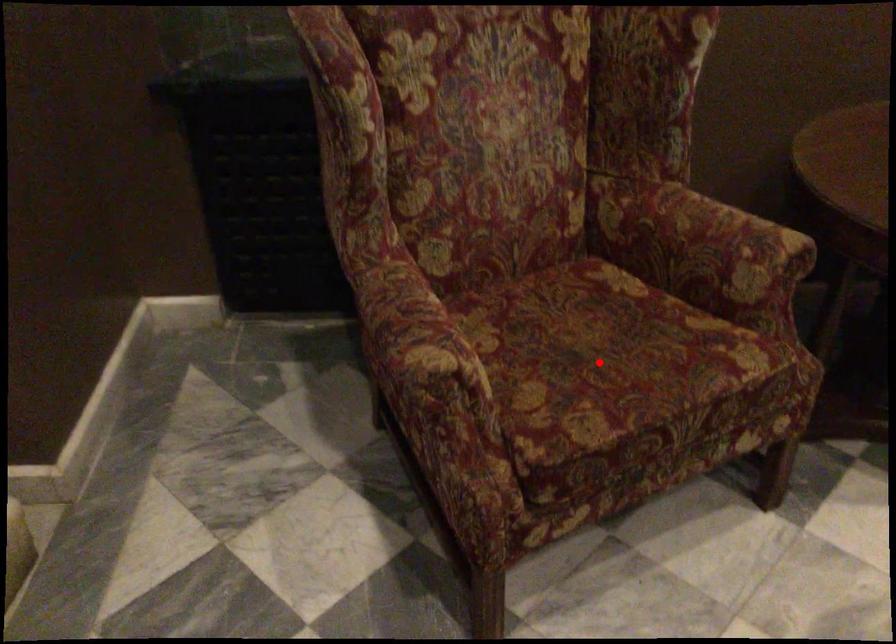
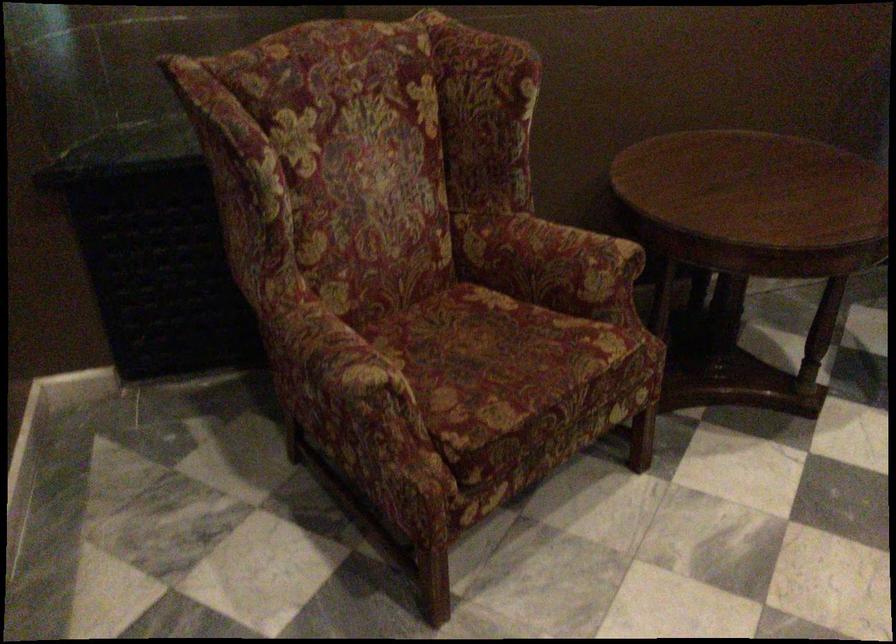
Question: I am providing you with two images of the same scene from different viewpoints. A red point is shown in image1. For the corresponding object point in image2, is it positioned nearer or farther from the camera?

Choices:
 (A) Nearer
 (B) Farther

Answer: (B)